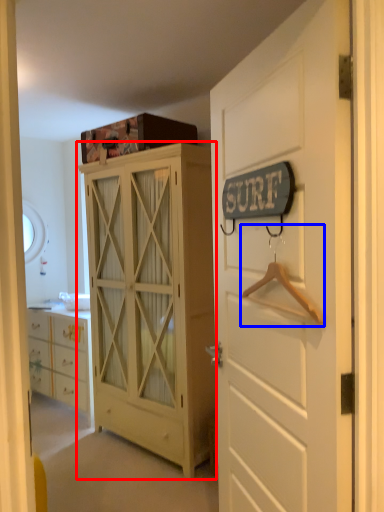
Question: Which object appears closest to the camera in this image, cabinetry (highlighted by a red box) or hanger (highlighted by a blue box)?

Choices:
 (A) cabinetry
 (B) hanger

Answer: (B)